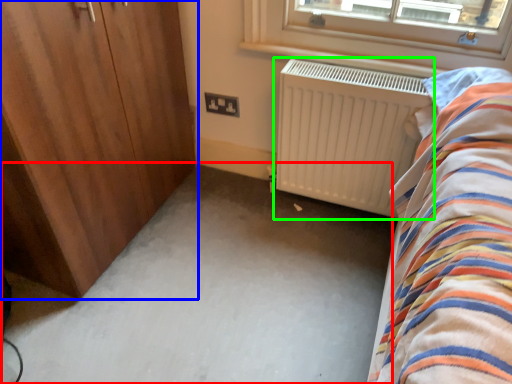
Question: Estimate the real-world distances between objects in this image. Which object is closer to plain (highlighted by a red box), door (highlighted by a blue box) or radiator (highlighted by a green box)?

Choices:
 (A) door
 (B) radiator

Answer: (B)